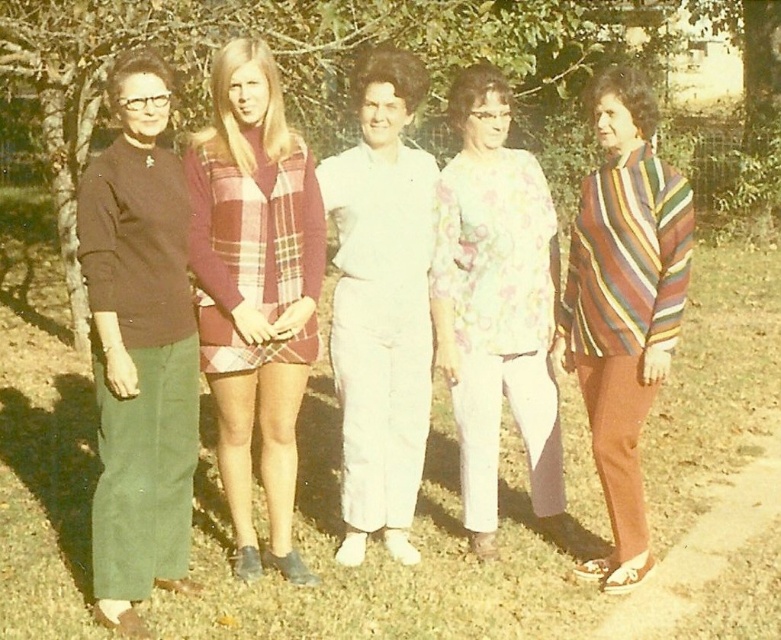
Question: Is plaid fabric dress at center smaller than striped sweater at right?

Choices:
 (A) yes
 (B) no

Answer: (B)

Question: Does matte brown sweater at left have a larger size compared to plaid fabric dress at center?

Choices:
 (A) no
 (B) yes

Answer: (A)

Question: Which object is farther from the camera taking this photo?

Choices:
 (A) green leafy tree at upper center
 (B) plaid fabric dress at center
 (C) floral-patterned fabric blouse at center

Answer: (A)

Question: Which point is closer to the camera?

Choices:
 (A) (662, 355)
 (B) (526, 346)
 (C) (163, 384)
 (D) (407, 80)

Answer: (C)

Question: Considering the relative positions of matte brown sweater at left and plaid fabric dress at center in the image provided, where is matte brown sweater at left located with respect to plaid fabric dress at center?

Choices:
 (A) left
 (B) right

Answer: (A)

Question: Which of the following is the closest to the observer?

Choices:
 (A) (187, 17)
 (B) (366, 128)

Answer: (B)